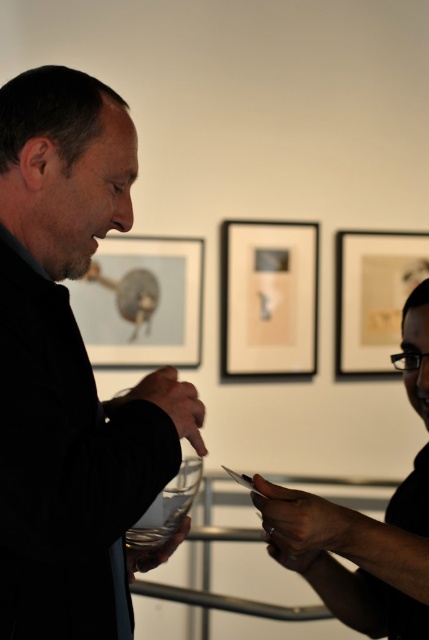
Question: Considering the real-world distances, which object is farthest from the black matte card at center?

Choices:
 (A) matte glass picture frame at upper left
 (B) transparent glass at center

Answer: (A)

Question: Based on their relative distances, which object is farther from the black matte jacket at left?

Choices:
 (A) matte black picture frame at center
 (B) transparent glass at center
 (C) matte glass picture frame at upper left
 (D) matte paper picture frame at upper right

Answer: (D)

Question: Among these objects, which one is farthest from the camera?

Choices:
 (A) matte glass picture frame at upper left
 (B) black matte card at center
 (C) matte paper picture frame at upper right

Answer: (C)

Question: Can you confirm if black matte jacket at left is positioned to the right of matte glass picture frame at upper left?

Choices:
 (A) yes
 (B) no

Answer: (A)

Question: Is black matte jacket at left smaller than black matte card at center?

Choices:
 (A) no
 (B) yes

Answer: (B)

Question: Can you confirm if black matte jacket at left is smaller than transparent glass at center?

Choices:
 (A) yes
 (B) no

Answer: (B)